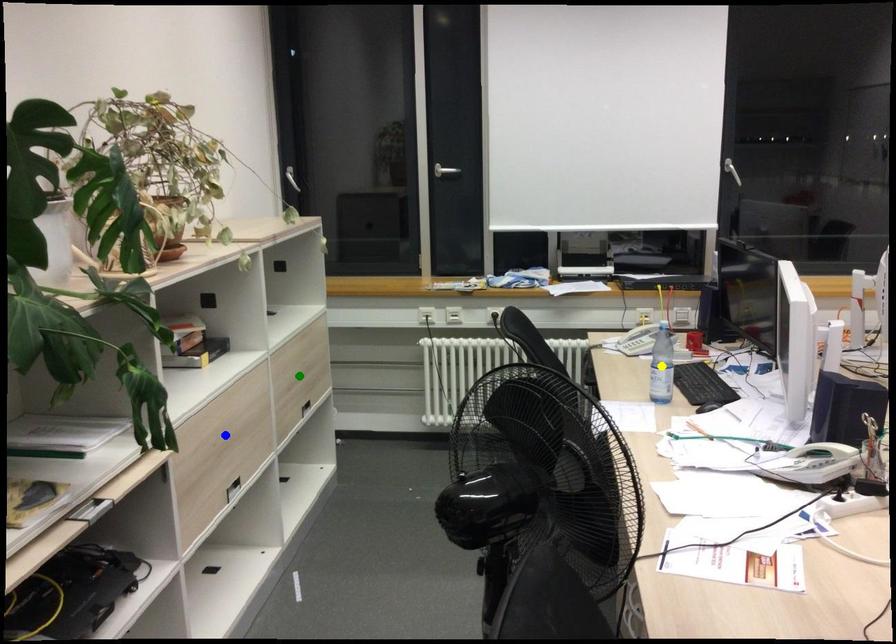
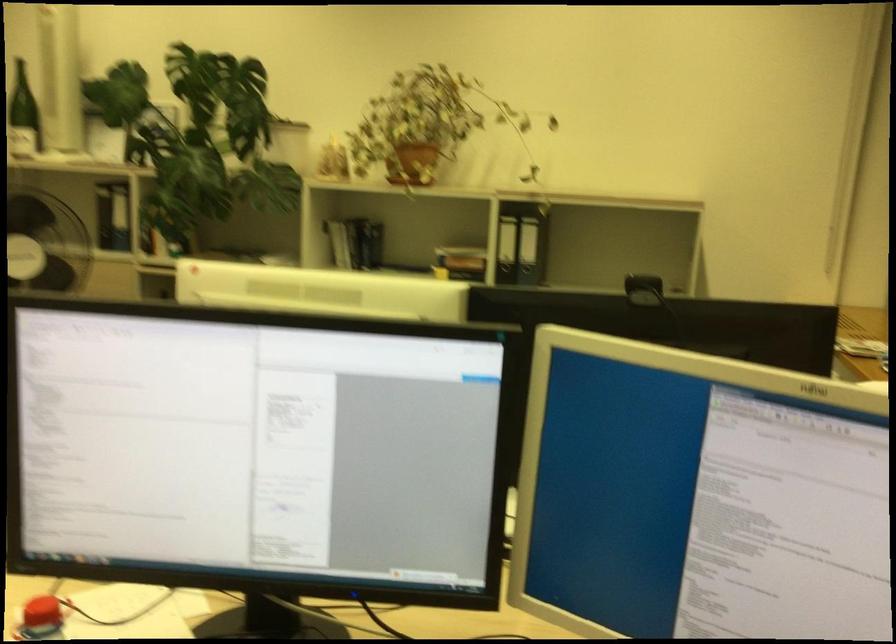
I am providing you with two images of the same scene from different viewpoints. Three points are marked in image1. Which point corresponds to a part or object that is occluded in image2?In image1, three points are marked. Which of them correspond to a part or object that is occluded in image2?Among the three points shown in image1, which one corresponds to a part or object that is no longer visible due to occlusion in image2?

green point, blue point, yellow point